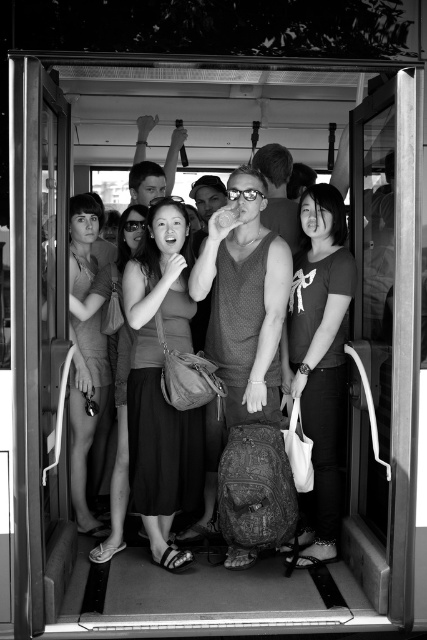
You are a photographer trying to capture the matte gray dress at center and the matte fabric dress at left in a single shot. Based on their positions, which dress should you focus on first to ensure both are in frame?

Result: The matte gray dress at center is located below the matte fabric dress at left, so you should focus on the matte fabric dress at left first to ensure both are in frame.

You are a photographer trying to capture a candid shot of the two dresses in the scene. Given that your camera has a depth of field that can focus on objects within 18 inches of each other, will both the matte gray dress at center and the matte fabric dress at left be in focus?

The matte gray dress at center and the matte fabric dress at left are 19.32 inches apart from each other. Since the depth of field can focus on objects within 18 inches, the distance between them exceeds this limit. Therefore, both dresses might not be in focus simultaneously.

You are standing in the tram and want to reach a bag that is at point (78, 477). There is an obstacle at point (195, 448). Will you need to go around the obstacle to reach the bag?

Point (195, 448) is closer to the viewer than point (78, 477), so the obstacle at point (195, 448) is in front of the bag at point (78, 477). Therefore, you will need to go around the obstacle to reach the bag.